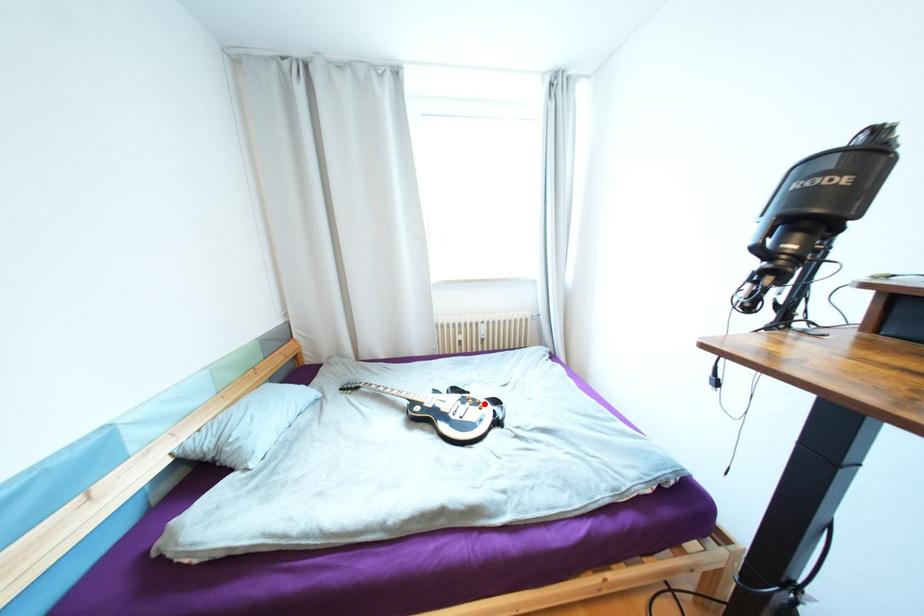
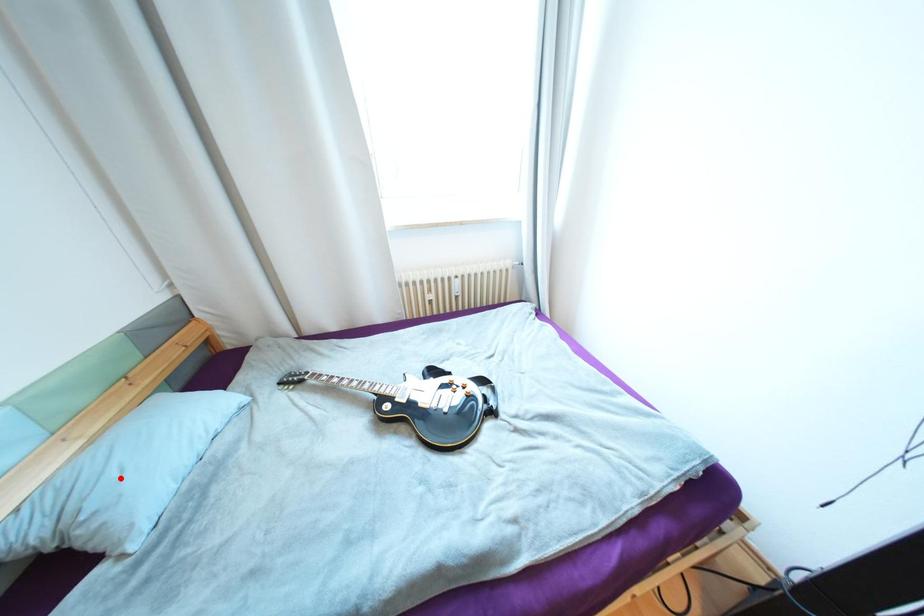
Consider the image. I am providing you with two images of the same scene from different viewpoints. A red point is marked on the first image and another point is marked on the second image. Are the points marked in image1 and image2 representing the same 3D position?

No